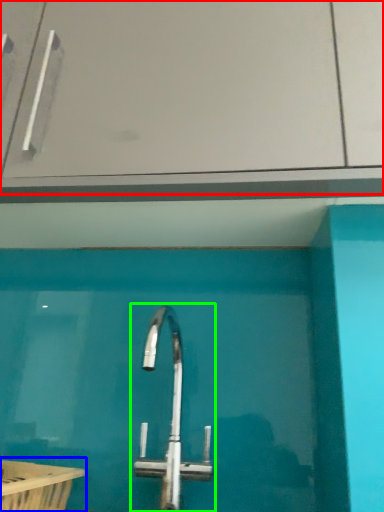
Question: Considering the real-world distances, which object is closest to glass door (highlighted by a red box)? bath (highlighted by a blue box) or tap (highlighted by a green box).

Choices:
 (A) bath
 (B) tap

Answer: (B)